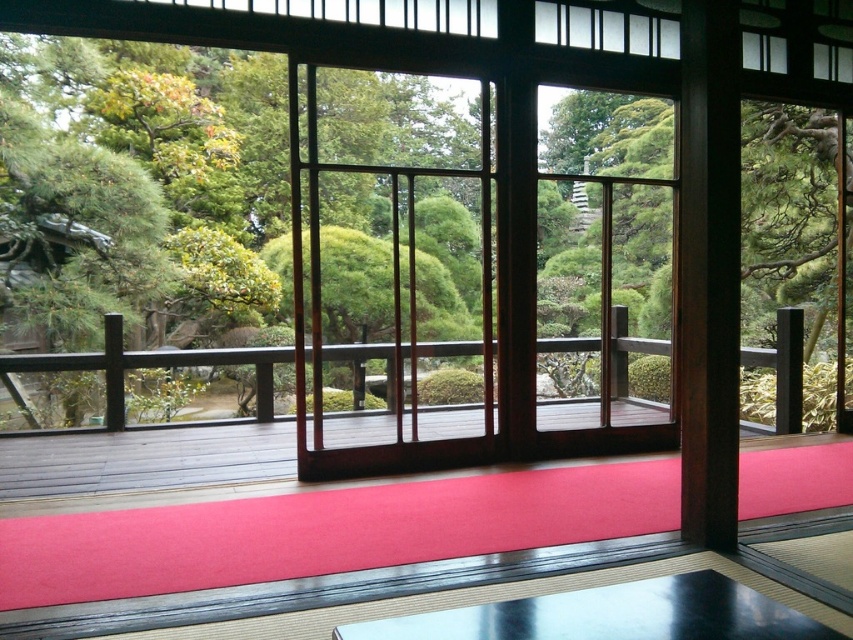
Question: Does green leafy tree at center have a greater width compared to smooth red mat at center?

Choices:
 (A) no
 (B) yes

Answer: (B)

Question: Which point is closer to the camera taking this photo?

Choices:
 (A) (788, 410)
 (B) (666, 502)

Answer: (B)

Question: Considering the relative positions of green leafy tree at center and smooth red mat at center in the image provided, where is green leafy tree at center located with respect to smooth red mat at center?

Choices:
 (A) above
 (B) below

Answer: (A)

Question: Is green leafy tree at center below smooth red mat at center?

Choices:
 (A) yes
 (B) no

Answer: (B)